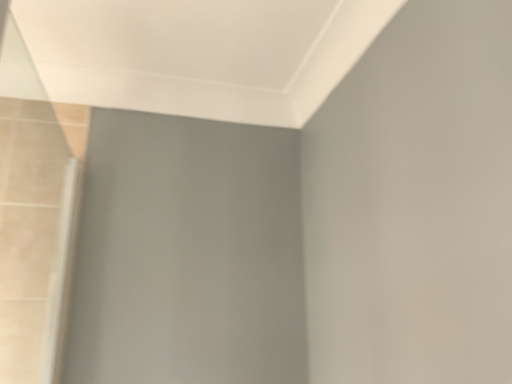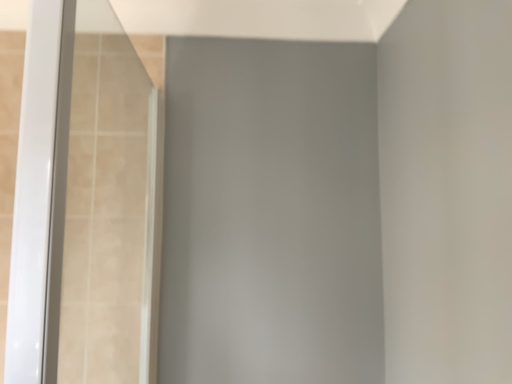
Question: Which way did the camera rotate in the video?

Choices:
 (A) rotated upward
 (B) rotated downward

Answer: (B)